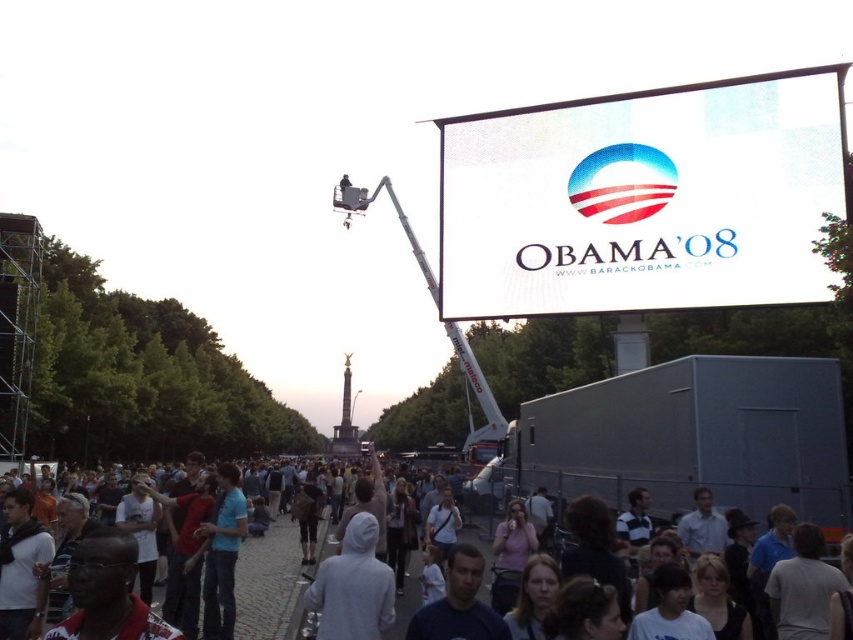
Between white matte billboard at upper center and gray hoodie at center, which one has more height?

white matte billboard at upper center is taller.

Which is behind, point (675, 291) or point (375, 595)?

Positioned behind is point (675, 291).

Where is `white matte billboard at upper center`? white matte billboard at upper center is located at coordinates (643, 198).

Which is above, white matte billboard at upper center or white hoodie at center?

Positioned higher is white matte billboard at upper center.

Is point (759, 298) closer to camera compared to point (283, 596)?

That is True.

Find the location of `white matte billboard at upper center`. white matte billboard at upper center is located at coordinates (643, 198).

Which is below, white hoodie at center or gray hoodie at center?

white hoodie at center is below.

Does white hoodie at center have a lesser width compared to gray hoodie at center?

No, white hoodie at center is not thinner than gray hoodie at center.

You are a GUI agent. You are given a task and a screenshot of the screen. Output one action in this format:
    pyautogui.click(x=<x>, y=<y>)
    Task: Click on the white hoodie at center
    
    Given the screenshot: What is the action you would take?
    pyautogui.click(x=270, y=582)